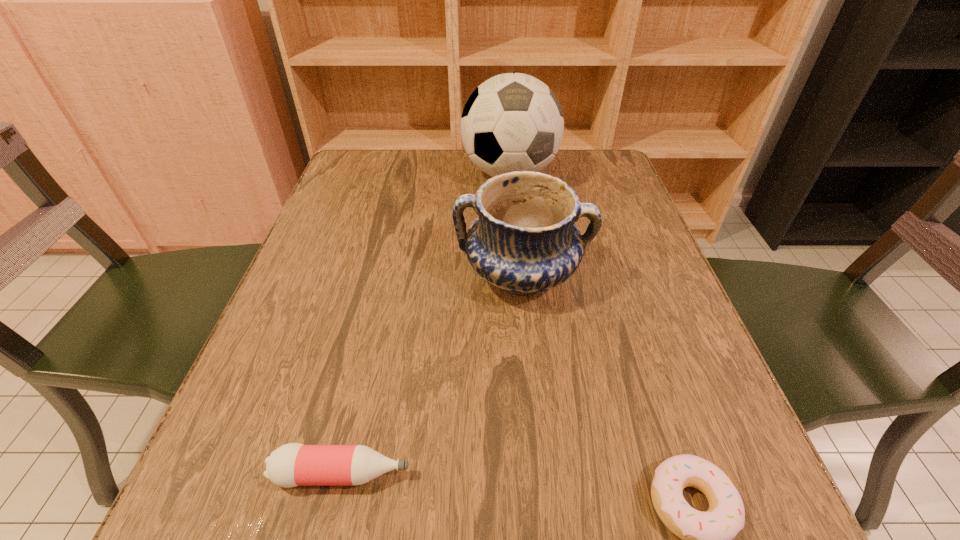
Find the location of `object that is positioned at the near edge`. object that is positioned at the near edge is located at coordinates (294, 464).

Where is `object at the left edge`? The width and height of the screenshot is (960, 540). object at the left edge is located at coordinates 294,464.

You are a GUI agent. You are given a task and a screenshot of the screen. Output one action in this format:
    pyautogui.click(x=<x>, y=<y>)
    Task: Click on the object that is at the right edge
    This screenshot has height=540, width=960.
    Given the screenshot: What is the action you would take?
    pyautogui.click(x=524, y=240)

This screenshot has height=540, width=960. Find the location of `object that is at the near left corner`. object that is at the near left corner is located at coordinates (294, 464).

Identify the location of vacant space at the far edge. The width and height of the screenshot is (960, 540). point(436,168).

This screenshot has height=540, width=960. What are the coordinates of `vacant region at the left edge` in the screenshot? It's located at (317, 309).

The height and width of the screenshot is (540, 960). I want to click on vacant region at the right edge of the desktop, so click(x=602, y=204).

Find the location of a particular element. This screenshot has width=960, height=540. blank area at the far left corner is located at coordinates (380, 194).

The height and width of the screenshot is (540, 960). I want to click on free space at the near left corner of the desktop, so coord(226,509).

Locate an element on the screen. free spot at the far right corner of the desktop is located at coordinates (612, 177).